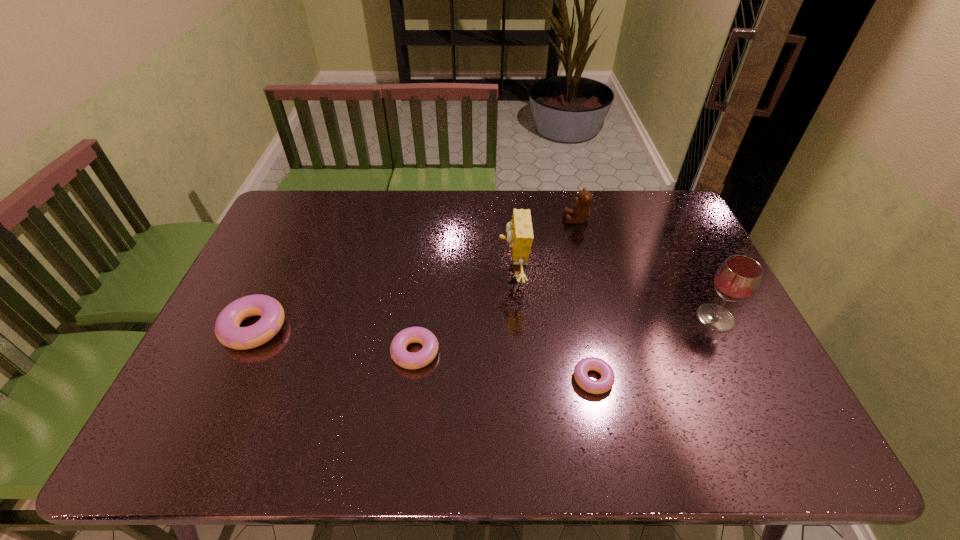
Locate which object is the closest to the wineglass. Please provide its 2D coordinates. Your answer should be formatted as a tuple, i.e. [(x, y)], where the tuple contains the x and y coordinates of a point satisfying the conditions above.

[(605, 383)]

Where is `object identified as the third closest to the leftmost object`? object identified as the third closest to the leftmost object is located at coordinates (605, 383).

Where is `the closest doughnut to the shortest doughnut`? The image size is (960, 540). the closest doughnut to the shortest doughnut is located at coordinates (408, 360).

This screenshot has height=540, width=960. What are the coordinates of `doughnut that can be found as the second closest to the fifth object from right to left` in the screenshot? It's located at (605, 383).

Find the location of a particular element. Image resolution: width=960 pixels, height=540 pixels. free space in the image that satisfies the following two spatial constraints: 1. on the face of the wineglass; 2. on the right side of the third tallest object is located at coordinates (601, 318).

At what (x,y) coordinates should I click in order to perform the action: click on vacant space that satisfies the following two spatial constraints: 1. on the front side of the second shortest object; 2. on the right side of the shortest object. Please return your answer as a coordinate pair (x, y). This screenshot has height=540, width=960. Looking at the image, I should click on (412, 379).

Image resolution: width=960 pixels, height=540 pixels. Find the location of `free space that satisfies the following two spatial constraints: 1. on the back side of the rightmost object; 2. on the right side of the third shortest object`. free space that satisfies the following two spatial constraints: 1. on the back side of the rightmost object; 2. on the right side of the third shortest object is located at coordinates (259, 318).

Where is `free space that satisfies the following two spatial constraints: 1. on the face of the third object from left to right; 2. on the left side of the wineglass`? This screenshot has width=960, height=540. free space that satisfies the following two spatial constraints: 1. on the face of the third object from left to right; 2. on the left side of the wineglass is located at coordinates (516, 318).